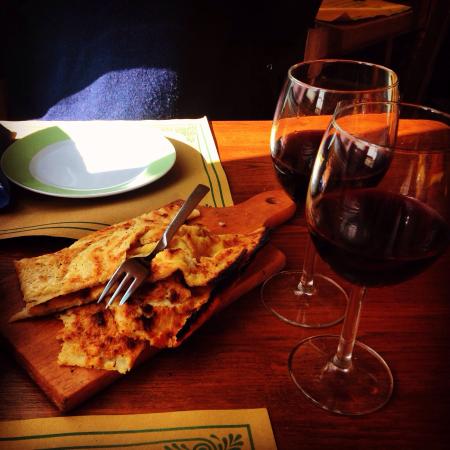
Locate an element on the screen. blue fuzzy cloth is located at coordinates (130, 86).